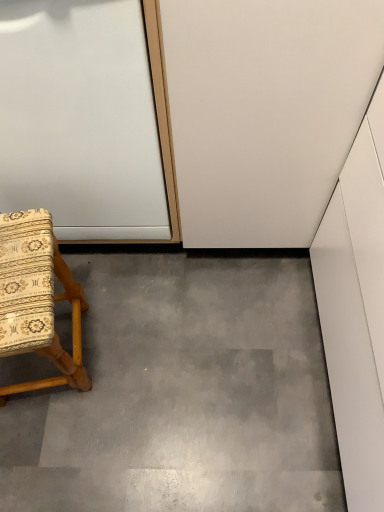
This screenshot has width=384, height=512. I want to click on wooden-patterned fabric chair at lower left, so click(x=36, y=298).

Describe the element at coordinates (36, 298) in the screenshot. I see `wooden-patterned fabric chair at lower left` at that location.

The image size is (384, 512). What are the coordinates of `white glossy door at upper left` in the screenshot? It's located at (86, 120).

Is the position of white glossy door at upper left more distant than that of wooden-patterned fabric chair at lower left?

That is False.

Does white glossy door at upper left have a lesser width compared to wooden-patterned fabric chair at lower left?

No.

Considering the relative sizes of white glossy door at upper left and wooden-patterned fabric chair at lower left in the image provided, is white glossy door at upper left smaller than wooden-patterned fabric chair at lower left?

Actually, white glossy door at upper left might be larger than wooden-patterned fabric chair at lower left.

Is white glossy door at upper left placed right next to wooden-patterned fabric chair at lower left?

No, white glossy door at upper left is not in contact with wooden-patterned fabric chair at lower left.

What's the angular difference between wooden-patterned fabric chair at lower left and gray concrete at lower left's facing directions?

99.9 degrees.

Identify the location of chair above the gray concrete at lower left (from a real-world perspective). (36, 298).

Considering the relative positions of wooden-patterned fabric chair at lower left and gray concrete at lower left in the image provided, is wooden-patterned fabric chair at lower left to the left of gray concrete at lower left from the viewer's perspective?

Indeed, wooden-patterned fabric chair at lower left is positioned on the left side of gray concrete at lower left.

Which of these two, wooden-patterned fabric chair at lower left or gray concrete at lower left, stands shorter?

gray concrete at lower left is shorter.

Does gray concrete at lower left have a smaller size compared to white glossy door at upper left?

Yes, gray concrete at lower left is smaller than white glossy door at upper left.

Does point (201, 390) appear closer or farther from the camera than point (73, 192)?

Point (201, 390).

Looking at this image, is gray concrete at lower left shorter than white glossy door at upper left?

Indeed, gray concrete at lower left has a lesser height compared to white glossy door at upper left.

From the image's perspective, between gray concrete at lower left and white glossy door at upper left, which one is located above?

white glossy door at upper left is shown above in the image.

From a real-world perspective, is wooden-patterned fabric chair at lower left on white glossy door at upper left?

No, from a real-world perspective, wooden-patterned fabric chair at lower left is not above white glossy door at upper left.

Which of these two, wooden-patterned fabric chair at lower left or white glossy door at upper left, is wider?

white glossy door at upper left.

Does wooden-patterned fabric chair at lower left lie behind white glossy door at upper left?

Yes.

From the image's perspective, which is below, wooden-patterned fabric chair at lower left or white glossy door at upper left?

wooden-patterned fabric chair at lower left, from the image's perspective.

Are white glossy door at upper left and gray concrete at lower left beside each other?

No, white glossy door at upper left is not beside gray concrete at lower left.

Is white glossy door at upper left looking in the opposite direction of gray concrete at lower left?

No, white glossy door at upper left is not facing the opposite direction of gray concrete at lower left.

How different are the orientations of white glossy door at upper left and gray concrete at lower left in degrees?

89.9 degrees separate the facing orientations of white glossy door at upper left and gray concrete at lower left.

Who is taller, white glossy door at upper left or gray concrete at lower left?

white glossy door at upper left is taller.

Does point (68, 431) come closer to viewer compared to point (79, 353)?

Yes, it is.

Is gray concrete at lower left positioned before wooden-patterned fabric chair at lower left?

No.

Is gray concrete at lower left oriented away from wooden-patterned fabric chair at lower left?

That's not correct — gray concrete at lower left is not looking away from wooden-patterned fabric chair at lower left.

Which of these two, gray concrete at lower left or wooden-patterned fabric chair at lower left, is smaller?

gray concrete at lower left.

This screenshot has height=512, width=384. I want to click on chair below the white glossy door at upper left (from a real-world perspective), so click(x=36, y=298).

Identify the location of chair in front of the gray concrete at lower left. The image size is (384, 512). (36, 298).

Considering their positions, is wooden-patterned fabric chair at lower left positioned closer to white glossy door at upper left than gray concrete at lower left?

wooden-patterned fabric chair at lower left.

Looking at the image, which one is located further to wooden-patterned fabric chair at lower left, gray concrete at lower left or white glossy door at upper left?

gray concrete at lower left is further to wooden-patterned fabric chair at lower left.

From the image, which object appears to be farther from wooden-patterned fabric chair at lower left, white glossy door at upper left or gray concrete at lower left?

gray concrete at lower left is positioned further to the anchor wooden-patterned fabric chair at lower left.

Estimate the real-world distances between objects in this image. Which object is closer to white glossy door at upper left, gray concrete at lower left or wooden-patterned fabric chair at lower left?

wooden-patterned fabric chair at lower left.

Looking at the image, which one is located further to gray concrete at lower left, wooden-patterned fabric chair at lower left or white glossy door at upper left?

white glossy door at upper left is further to gray concrete at lower left.

When comparing their distances from gray concrete at lower left, does white glossy door at upper left or wooden-patterned fabric chair at lower left seem further?

white glossy door at upper left is further to gray concrete at lower left.

You are a GUI agent. You are given a task and a screenshot of the screen. Output one action in this format:
    pyautogui.click(x=<x>, y=<y>)
    Task: Click on the chair between white glossy door at upper left and gray concrete at lower left in the up-down direction
    The height and width of the screenshot is (512, 384).
    Given the screenshot: What is the action you would take?
    pyautogui.click(x=36, y=298)